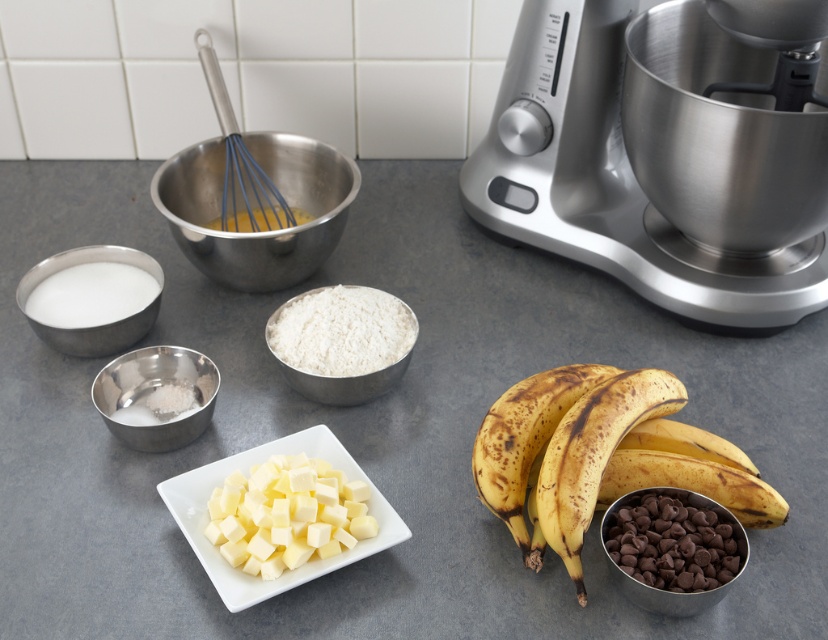
You are standing in the kitchen and see the point at coordinates [600,456]. What object is located at that point?

The point at coordinates [600,456] is on the brown spotted bananas at lower right.

You are preparing to bake a cake and need to place both the white creamy butter at center and the ripe yellow bananas at lower right on the counter. Based on their sizes, which one requires more counter space?

The ripe yellow bananas at lower right require more counter space because they occupy more space than the white creamy butter at center according to the description.